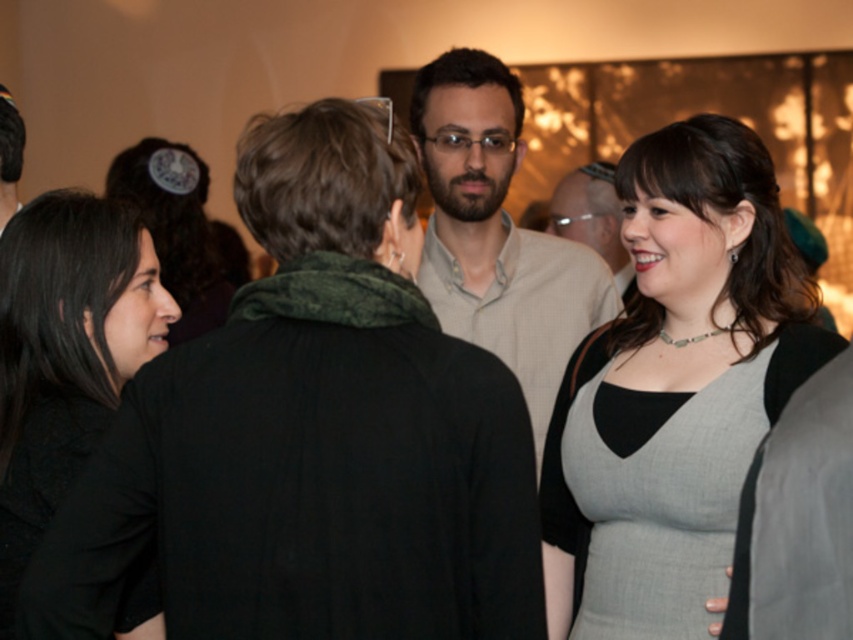
What do you see at coordinates (312, 433) in the screenshot? Image resolution: width=853 pixels, height=640 pixels. I see `matte black dress at lower right` at bounding box center [312, 433].

Does matte black dress at lower right have a larger size compared to black matte dress at left?

Indeed, matte black dress at lower right has a larger size compared to black matte dress at left.

Who is more forward, (235, 548) or (91, 266)?

Point (235, 548) is more forward.

You are a GUI agent. You are given a task and a screenshot of the screen. Output one action in this format:
    pyautogui.click(x=<x>, y=<y>)
    Task: Click on the matte black dress at lower right
    
    Given the screenshot: What is the action you would take?
    pyautogui.click(x=312, y=433)

Can you confirm if gray fabric dress at center is positioned below black matte dress at left?

Correct, gray fabric dress at center is located below black matte dress at left.

Which is more to the right, gray fabric dress at center or black matte dress at left?

From the viewer's perspective, gray fabric dress at center appears more on the right side.

Does point (564, 556) come farther from viewer compared to point (80, 298)?

Yes, point (564, 556) is behind point (80, 298).

This screenshot has height=640, width=853. I want to click on gray fabric dress at center, so click(675, 388).

Can you confirm if gray fabric dress at center is positioned below matte black shirt at center?

Yes.

Is gray fabric dress at center positioned at the back of matte black shirt at center?

No, it is not.

What do you see at coordinates (675, 388) in the screenshot? The height and width of the screenshot is (640, 853). I see `gray fabric dress at center` at bounding box center [675, 388].

You are a GUI agent. You are given a task and a screenshot of the screen. Output one action in this format:
    pyautogui.click(x=<x>, y=<y>)
    Task: Click on the gray fabric dress at center
    
    Given the screenshot: What is the action you would take?
    pyautogui.click(x=675, y=388)